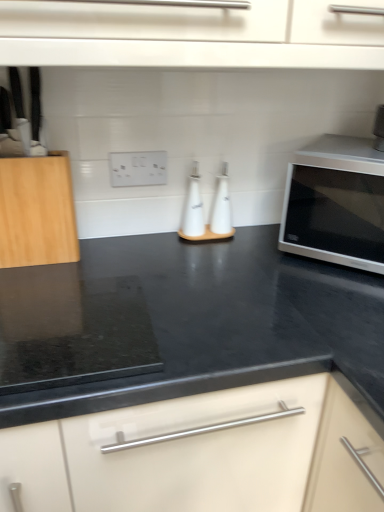
Question: From the image's perspective, relative to white matte oil bottle at center, which ranks as the 2th bottle in right-to-left order, is white plastic electric outlet at center above or below?

Choices:
 (A) below
 (B) above

Answer: (B)

Question: Based on their positions, is white plastic electric outlet at center located to the left or right of white matte oil bottle at center, which is the 1th bottle in left-to-right order?

Choices:
 (A) right
 (B) left

Answer: (B)

Question: Which of these objects is positioned closest to the natural wood cutting board at left?

Choices:
 (A) white plastic electric outlet at center
 (B) white glossy bottle at center, the second bottle from the left
 (C) white matte oil bottle at center, which ranks as the 2th bottle in right-to-left order
 (D) satin silver microwave at right

Answer: (A)

Question: Which of these objects is positioned closest to the white glossy bottle at center, the second bottle from the left?

Choices:
 (A) white plastic electric outlet at center
 (B) satin silver microwave at right
 (C) natural wood cutting board at left
 (D) white matte oil bottle at center, which ranks as the 2th bottle in right-to-left order

Answer: (D)